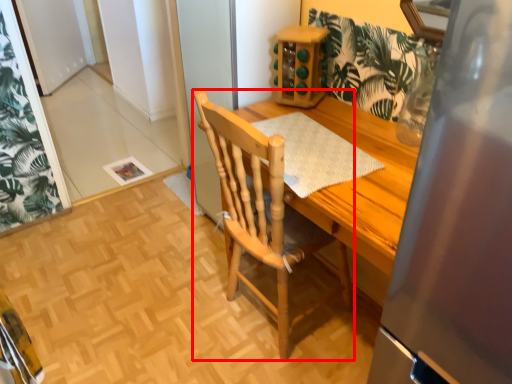
Question: From the image's perspective, where is chair (annotated by the red box) located relative to place mat?

Choices:
 (A) above
 (B) below

Answer: (B)